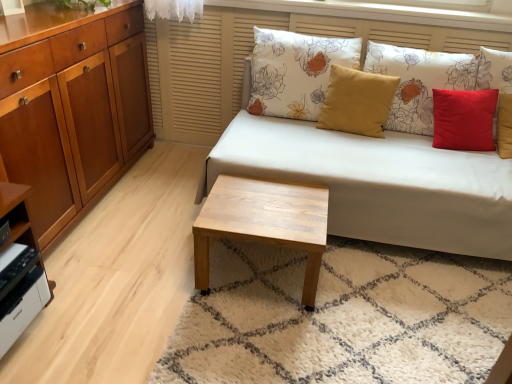
This screenshot has height=384, width=512. What do you see at coordinates (419, 81) in the screenshot?
I see `red matte pillow at upper right, marked as the first pillow in a right-to-left arrangement` at bounding box center [419, 81].

Identify the location of red matte pillow at upper right, which ranks as the 3th pillow in left-to-right order. The image size is (512, 384). (419, 81).

Describe the element at coordinates (295, 71) in the screenshot. Image resolution: width=512 pixels, height=384 pixels. I see `floral fabric pillow at upper center, marked as the 1th pillow in a left-to-right arrangement` at that location.

The image size is (512, 384). What are the coordinates of `matte wood cabinet at left` in the screenshot? It's located at point(74,115).

Who is taller, matte yellow pillow at center, which is counted as the 2th pillow, starting from the right, or floral fabric pillow at upper center, marked as the 1th pillow in a left-to-right arrangement?

floral fabric pillow at upper center, marked as the 1th pillow in a left-to-right arrangement.

Is the surface of matte yellow pillow at center, which is counted as the 2th pillow, starting from the right, in direct contact with floral fabric pillow at upper center, placed as the 3th pillow when sorted from right to left?

No, matte yellow pillow at center, which is counted as the 2th pillow, starting from the right, is not making contact with floral fabric pillow at upper center, placed as the 3th pillow when sorted from right to left.

Does matte yellow pillow at center, the second pillow when ordered from left to right, have a larger size compared to floral fabric pillow at upper center, placed as the 3th pillow when sorted from right to left?

No.

Is matte yellow pillow at center, which is counted as the 2th pillow, starting from the right, at the right side of floral fabric pillow at upper center, placed as the 3th pillow when sorted from right to left?

Indeed, matte yellow pillow at center, which is counted as the 2th pillow, starting from the right, is positioned on the right side of floral fabric pillow at upper center, placed as the 3th pillow when sorted from right to left.

How many degrees apart are the facing directions of floral fabric pillow at upper center, marked as the 1th pillow in a left-to-right arrangement, and white matte printer at lower left?

There is a 90.3-degree angle between the facing directions of floral fabric pillow at upper center, marked as the 1th pillow in a left-to-right arrangement, and white matte printer at lower left.

Locate an element on the screen. This screenshot has width=512, height=384. appliance beneath the floral fabric pillow at upper center, marked as the 1th pillow in a left-to-right arrangement (from a real-world perspective) is located at coordinates (22, 306).

Considering the relative sizes of floral fabric pillow at upper center, marked as the 1th pillow in a left-to-right arrangement, and white matte printer at lower left in the image provided, is floral fabric pillow at upper center, marked as the 1th pillow in a left-to-right arrangement, shorter than white matte printer at lower left?

No, floral fabric pillow at upper center, marked as the 1th pillow in a left-to-right arrangement, is not shorter than white matte printer at lower left.

Can white fabric couch at center be found inside red matte pillow at upper right, marked as the first pillow in a right-to-left arrangement?

No, white fabric couch at center is not surrounded by red matte pillow at upper right, marked as the first pillow in a right-to-left arrangement.

Between red matte pillow at upper right, marked as the first pillow in a right-to-left arrangement, and white fabric couch at center, which one has larger width?

Wider between the two is white fabric couch at center.

Is red matte pillow at upper right, marked as the first pillow in a right-to-left arrangement, facing away from white fabric couch at center?

Yes, red matte pillow at upper right, marked as the first pillow in a right-to-left arrangement, is facing away from white fabric couch at center.

From a real-world perspective, which is physically above, red matte pillow at upper right, which ranks as the 3th pillow in left-to-right order, or white fabric couch at center?

red matte pillow at upper right, which ranks as the 3th pillow in left-to-right order, is physically above.

Is red matte pillow at upper right, which ranks as the 3th pillow in left-to-right order, inside matte yellow pillow at center, which is counted as the 2th pillow, starting from the right?

No, matte yellow pillow at center, which is counted as the 2th pillow, starting from the right, does not contain red matte pillow at upper right, which ranks as the 3th pillow in left-to-right order.

Which of these two, matte yellow pillow at center, the second pillow when ordered from left to right, or red matte pillow at upper right, marked as the first pillow in a right-to-left arrangement, stands taller?

red matte pillow at upper right, marked as the first pillow in a right-to-left arrangement, is taller.

Which is closer, [385,94] or [415,64]?

The point [385,94] is in front.

Does point (484, 178) come farther from viewer compared to point (14, 253)?

Yes.

From the image's perspective, relative to white matte printer at lower left, is white fabric couch at center above or below?

Based on their image positions, white fabric couch at center is located above white matte printer at lower left.

Is white fabric couch at center not within white matte printer at lower left?

white fabric couch at center lies outside white matte printer at lower left's area.

Visually, is matte yellow pillow at center, which is counted as the 2th pillow, starting from the right, positioned to the left or to the right of matte wood cabinet at left?

From the image, it's evident that matte yellow pillow at center, which is counted as the 2th pillow, starting from the right, is to the right of matte wood cabinet at left.

Considering the sizes of objects matte yellow pillow at center, which is counted as the 2th pillow, starting from the right, and matte wood cabinet at left in the image provided, who is smaller, matte yellow pillow at center, which is counted as the 2th pillow, starting from the right, or matte wood cabinet at left?

With smaller size is matte yellow pillow at center, which is counted as the 2th pillow, starting from the right.

From a real-world perspective, relative to matte wood cabinet at left, is matte yellow pillow at center, which is counted as the 2th pillow, starting from the right, vertically above or below?

matte yellow pillow at center, which is counted as the 2th pillow, starting from the right, is situated higher than matte wood cabinet at left in the real world.

In terms of height, does matte yellow pillow at center, the second pillow when ordered from left to right, look taller or shorter compared to matte wood cabinet at left?

In the image, matte yellow pillow at center, the second pillow when ordered from left to right, appears to be shorter than matte wood cabinet at left.

In the image, is matte wood cabinet at left on the left side or the right side of light wood/texture coffee table at center?

Based on their positions, matte wood cabinet at left is located to the left of light wood/texture coffee table at center.

In the scene shown: From the image's perspective, between matte wood cabinet at left and light wood/texture coffee table at center, who is located below?

light wood/texture coffee table at center.

Considering the relative sizes of matte wood cabinet at left and light wood/texture coffee table at center in the image provided, is matte wood cabinet at left thinner than light wood/texture coffee table at center?

Correct, the width of matte wood cabinet at left is less than that of light wood/texture coffee table at center.

Where is `pillow lying behind the matte yellow pillow at center, which is counted as the 2th pillow, starting from the right`? Image resolution: width=512 pixels, height=384 pixels. pillow lying behind the matte yellow pillow at center, which is counted as the 2th pillow, starting from the right is located at coordinates (295, 71).

The height and width of the screenshot is (384, 512). In order to click on appliance in front of the floral fabric pillow at upper center, placed as the 3th pillow when sorted from right to left in this screenshot , I will do `click(22, 306)`.

Looking at the image, which one is located closer to red matte pillow at upper right, marked as the first pillow in a right-to-left arrangement, white fabric couch at center or light wood/texture coffee table at center?

The object closer to red matte pillow at upper right, marked as the first pillow in a right-to-left arrangement, is white fabric couch at center.

Looking at the image, which one is located closer to matte wood cabinet at left, floral fabric pillow at upper center, placed as the 3th pillow when sorted from right to left, or white fabric couch at center?

floral fabric pillow at upper center, placed as the 3th pillow when sorted from right to left.

Estimate the real-world distances between objects in this image. Which object is further from matte wood cabinet at left, white matte printer at lower left or floral fabric pillow at upper center, marked as the 1th pillow in a left-to-right arrangement?

Based on the image, floral fabric pillow at upper center, marked as the 1th pillow in a left-to-right arrangement, appears to be further to matte wood cabinet at left.

When comparing their distances from floral fabric pillow at upper center, placed as the 3th pillow when sorted from right to left, does white fabric couch at center or red matte pillow at upper right, which ranks as the 3th pillow in left-to-right order, seem closer?

red matte pillow at upper right, which ranks as the 3th pillow in left-to-right order.

Estimate the real-world distances between objects in this image. Which object is further from white fabric couch at center, matte wood cabinet at left or white matte printer at lower left?

white matte printer at lower left is positioned further to the anchor white fabric couch at center.

Which object lies nearer to the anchor point white fabric couch at center, matte yellow pillow at center, which is counted as the 2th pillow, starting from the right, or white matte printer at lower left?

matte yellow pillow at center, which is counted as the 2th pillow, starting from the right, is closer to white fabric couch at center.

Based on their spatial positions, is matte yellow pillow at center, which is counted as the 2th pillow, starting from the right, or white matte printer at lower left closer to red matte pillow at upper right, which ranks as the 3th pillow in left-to-right order?

matte yellow pillow at center, which is counted as the 2th pillow, starting from the right, is positioned closer to the anchor red matte pillow at upper right, which ranks as the 3th pillow in left-to-right order.

Estimate the real-world distances between objects in this image. Which object is closer to light wood/texture coffee table at center, matte wood cabinet at left or floral fabric pillow at upper center, placed as the 3th pillow when sorted from right to left?

floral fabric pillow at upper center, placed as the 3th pillow when sorted from right to left, lies closer to light wood/texture coffee table at center than the other object.

Locate an element on the screen. This screenshot has height=384, width=512. pillow between white fabric couch at center and matte yellow pillow at center, which is counted as the 2th pillow, starting from the right, in the front-back direction is located at coordinates coord(419,81).

The image size is (512, 384). Find the location of `coffee table located between matte wood cabinet at left and floral fabric pillow at upper center, placed as the 3th pillow when sorted from right to left, in the left-right direction`. coffee table located between matte wood cabinet at left and floral fabric pillow at upper center, placed as the 3th pillow when sorted from right to left, in the left-right direction is located at coordinates (264, 223).

This screenshot has height=384, width=512. I want to click on coffee table located between matte wood cabinet at left and matte yellow pillow at center, which is counted as the 2th pillow, starting from the right, in the left-right direction, so click(x=264, y=223).

I want to click on coffee table between white matte printer at lower left and floral fabric pillow at upper center, placed as the 3th pillow when sorted from right to left, so click(x=264, y=223).